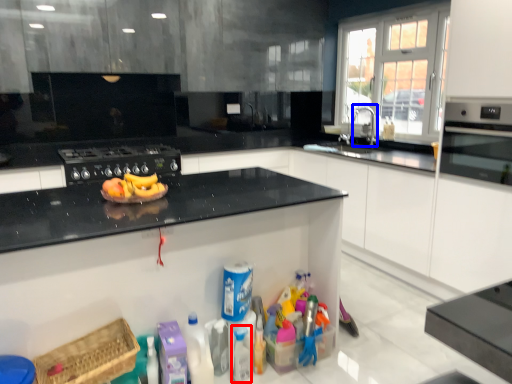
Question: Which of the following is the farthest to the observer, bottle (highlighted by a red box) or faucet (highlighted by a blue box)?

Choices:
 (A) bottle
 (B) faucet

Answer: (B)